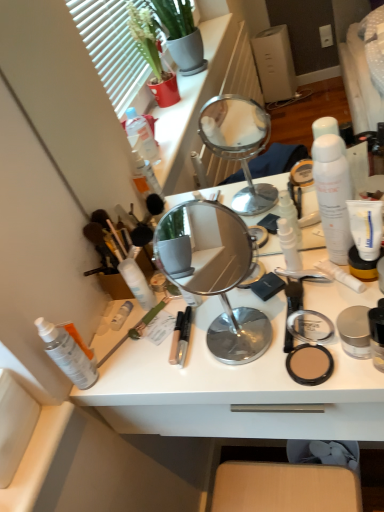
Image resolution: width=384 pixels, height=512 pixels. What are the coordinates of `free space that is in between polished silver mirror at center and transparent plastic spray bottle at lower left, the 1th toiletry from the left` in the screenshot? It's located at click(x=153, y=361).